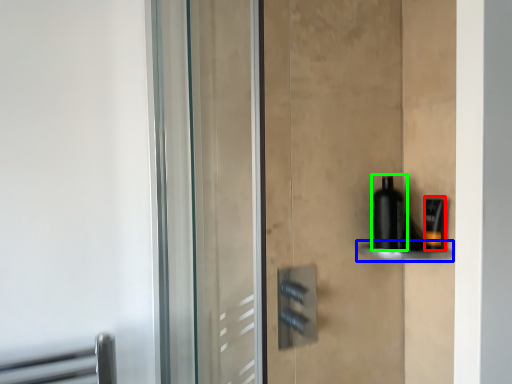
Question: Which is nearer to the toiletry (highlighted by a red box)? shelf (highlighted by a blue box) or bottle (highlighted by a green box).

Choices:
 (A) shelf
 (B) bottle

Answer: (A)